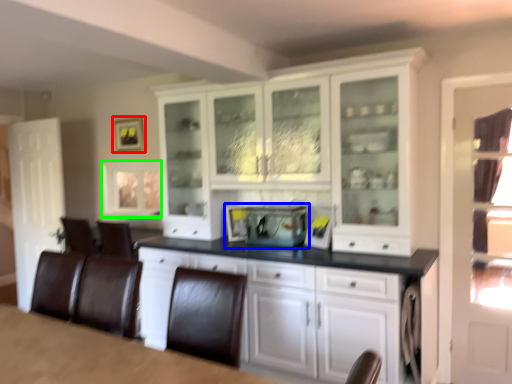
Question: Which object is positioned farthest from picture frame (highlighted by a red box)? Select from appliance (highlighted by a blue box) and window (highlighted by a green box).

Choices:
 (A) appliance
 (B) window

Answer: (A)